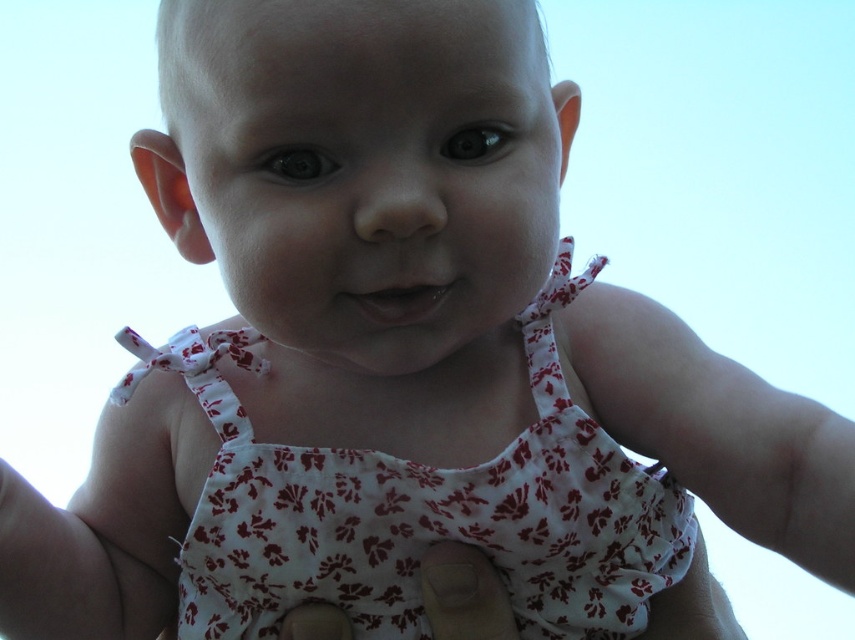
Question: From the image, what is the correct spatial relationship of white floral fabric dress at center in relation to white fabric diaper at center?

Choices:
 (A) right
 (B) left

Answer: (A)

Question: Among these points, which one is nearest to the camera?

Choices:
 (A) (513, 636)
 (B) (429, 474)

Answer: (B)

Question: Which point is closer to the camera?

Choices:
 (A) white floral fabric dress at center
 (B) white fabric diaper at center

Answer: (A)

Question: Observing the image, what is the correct spatial positioning of white floral fabric dress at center in reference to white fabric diaper at center?

Choices:
 (A) below
 (B) above

Answer: (B)

Question: Does white floral fabric dress at center have a lesser width compared to white fabric diaper at center?

Choices:
 (A) no
 (B) yes

Answer: (A)

Question: Which of the following is the closest to the observer?

Choices:
 (A) (464, 616)
 (B) (620, 493)

Answer: (A)